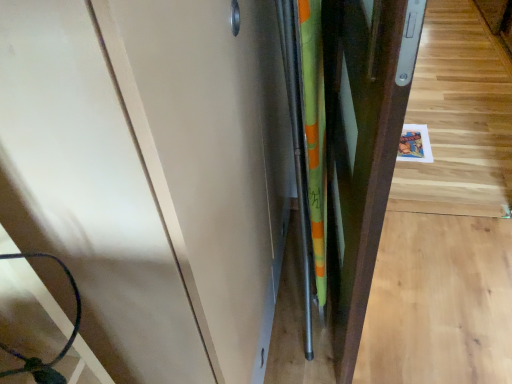
Measure the distance between point (358,159) and camera.

Point (358,159) and camera are 30.20 inches apart.

What is the approximate width of brown matte door at center?

It is 29.53 inches.

This screenshot has width=512, height=384. I want to click on brown matte door at center, so click(x=364, y=141).

Describe the element at coordinates (364, 141) in the screenshot. I see `brown matte door at center` at that location.

Where is `brown matte door at center`? Image resolution: width=512 pixels, height=384 pixels. brown matte door at center is located at coordinates (364, 141).